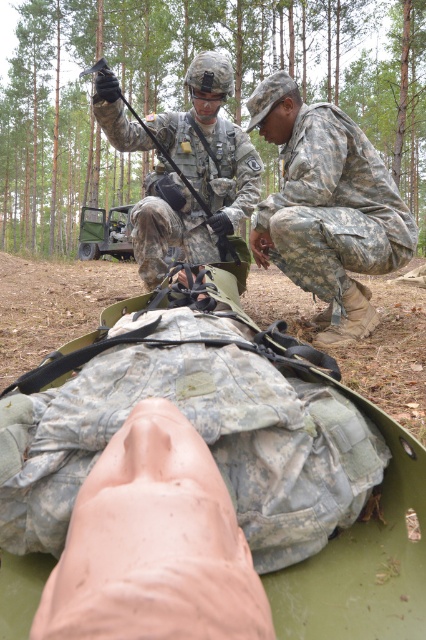
From the picture: You are a military medic assessing the scene. You see the camouflage uniform at upper center and the camouflage fabric vehicle at center. Which object is taller?

The camouflage uniform at upper center is taller than the camouflage fabric vehicle at center.

You are a military medic in the field and need to quickly assess the situation. Which object is nearer to you between the camouflage fabric uniform at lower right and the camouflage fabric vehicle at center?

The camouflage fabric uniform at lower right is closer to the viewer than the camouflage fabric vehicle at center, so the uniform is nearer.

You are a trainee in the military exercise and need to locate the point marked at coordinates point (327, 205). According to the scene, where exactly is this point located?

The point (327, 205) is located on the camouflage fabric uniform at lower right.